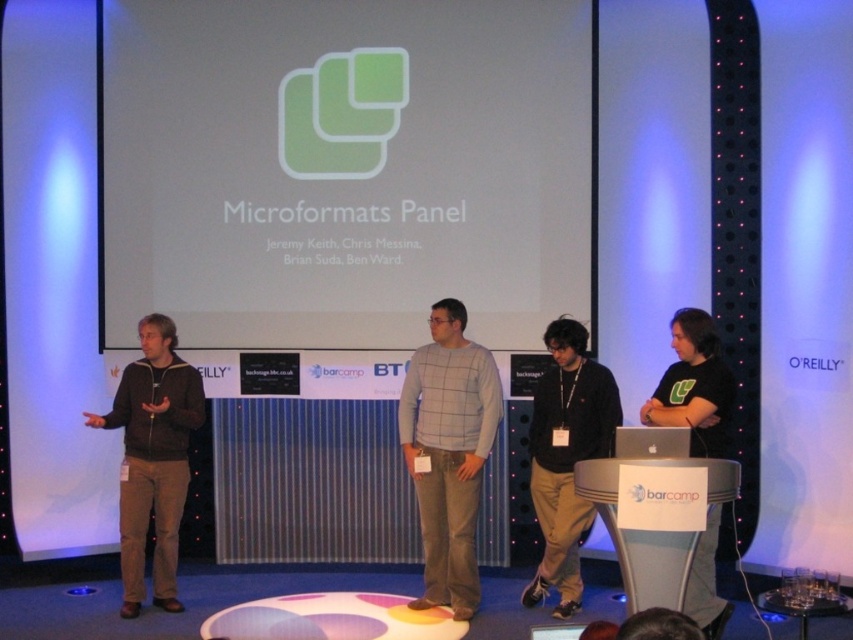
Question: Which point appears closest to the camera in this image?

Choices:
 (A) (654, 449)
 (B) (618, 396)

Answer: (A)

Question: Is dark brown jacket at left bigger than silver metallic laptop at center?

Choices:
 (A) no
 (B) yes

Answer: (B)

Question: Among these points, which one is nearest to the camera?

Choices:
 (A) (637, 456)
 (B) (715, 440)
 (C) (316, 20)
 (D) (563, 557)

Answer: (A)

Question: Considering the real-world distances, which object is farthest from the silver metallic laptop at center?

Choices:
 (A) dark brown jacket at left
 (B) black matte shirt at right

Answer: (A)

Question: Observing the image, what is the correct spatial positioning of black matte shirt at right in reference to silver metallic laptop at center?

Choices:
 (A) left
 (B) right

Answer: (B)

Question: Is white matte projection screen at center in front of black matte shirt at right?

Choices:
 (A) no
 (B) yes

Answer: (A)